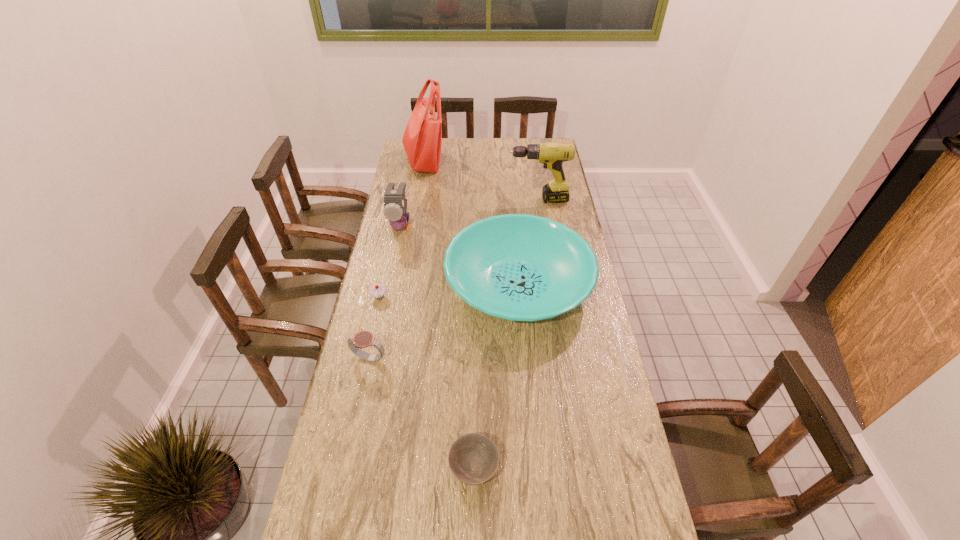
The width and height of the screenshot is (960, 540). I want to click on free point between the sixth shortest object and the fifth shortest object, so click(x=469, y=213).

This screenshot has width=960, height=540. In order to click on vacant area that lies between the shortest object and the fifth shortest object in this screenshot , I will do `click(438, 348)`.

This screenshot has height=540, width=960. I want to click on empty space that is in between the handbag and the bird, so click(x=412, y=194).

Locate an element on the screen. The height and width of the screenshot is (540, 960). empty space between the cupcake and the shortest object is located at coordinates (426, 383).

Where is `vacant space in between the sixth farthest object and the tallest object`? Image resolution: width=960 pixels, height=540 pixels. vacant space in between the sixth farthest object and the tallest object is located at coordinates pos(396,260).

Find the location of a particular element. The width and height of the screenshot is (960, 540). object that stands as the third closest to the nearest object is located at coordinates (377, 291).

Point out which object is positioned as the fifth nearest to the watch. Please provide its 2D coordinates. Your answer should be formatted as a tuple, i.e. [(x, y)], where the tuple contains the x and y coordinates of a point satisfying the conditions above.

[(552, 154)]

You are a GUI agent. You are given a task and a screenshot of the screen. Output one action in this format:
    pyautogui.click(x=<x>, y=<y>)
    Task: Click on the free space that satisfies the following two spatial constraints: 1. on the front side of the cupcake; 2. on the left side of the nearest object
    
    Given the screenshot: What is the action you would take?
    pyautogui.click(x=342, y=470)

Identify the location of vacant space that satisfies the following two spatial constraints: 1. on the back side of the shortest object; 2. on the front-facing side of the farthest object. tap(477, 161).

Image resolution: width=960 pixels, height=540 pixels. Identify the location of blank area in the image that satisfies the following two spatial constraints: 1. on the front-facing side of the handbag; 2. on the front side of the watch. (389, 359).